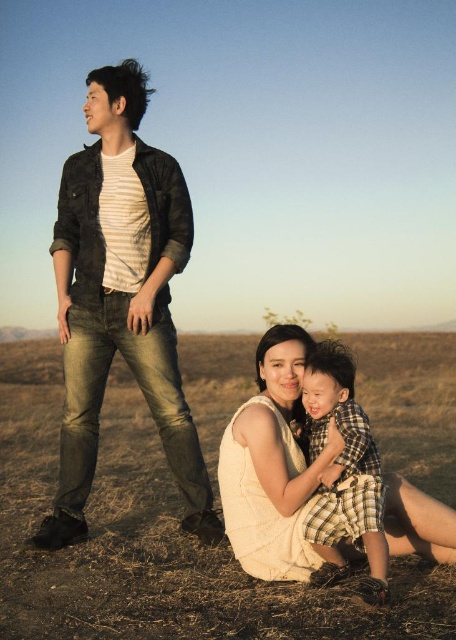
Question: Is the position of brown grass at lower center less distant than that of white sleeveless dress at lower center?

Choices:
 (A) yes
 (B) no

Answer: (A)

Question: Which object appears closest to the camera in this image?

Choices:
 (A) denim jeans at left
 (B) white sleeveless dress at lower center

Answer: (B)

Question: Among these points, which one is farthest from the camera?

Choices:
 (A) click(x=105, y=397)
 (B) click(x=160, y=237)

Answer: (A)

Question: Where is brown grass at lower center located in relation to denim jeans at left in the image?

Choices:
 (A) above
 (B) below

Answer: (B)

Question: Observing the image, what is the correct spatial positioning of white sleeveless dress at lower center in reference to plaid fabric baby at center?

Choices:
 (A) right
 (B) left

Answer: (B)

Question: Which object is farther from the camera taking this photo?

Choices:
 (A) brown grass at lower center
 (B) white sleeveless dress at lower center
 (C) plaid fabric baby at center
 (D) denim jeans at left

Answer: (D)